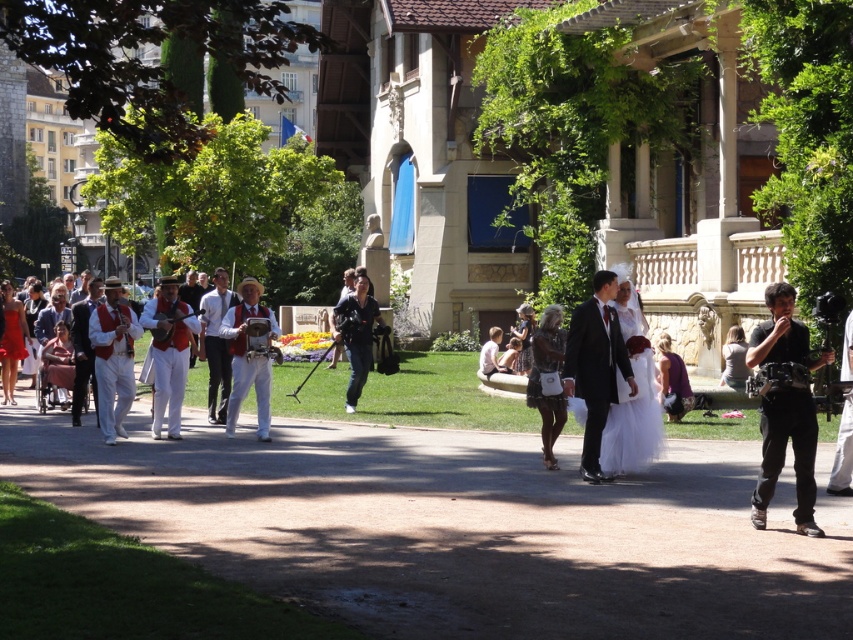
You are a photographer at the wedding and need to capture a photo of both the matte black dress at lower right and the matte white dress at center. Which dress will appear wider in the photo?

The matte black dress at lower right will appear wider in the photo because its width is larger than the matte white dress at center.

You are standing at the origin point of the image. Which object is located at the coordinates point (595, 365)?

The shiny black suit at center is located at point (595, 365).

You are a photographer at the wedding and want to take a photo of the shiny black suit at center and the matte black suit at center. Which one is closer to the camera?

The shiny black suit at center is in front of the matte black suit at center, so it is closer to the camera.